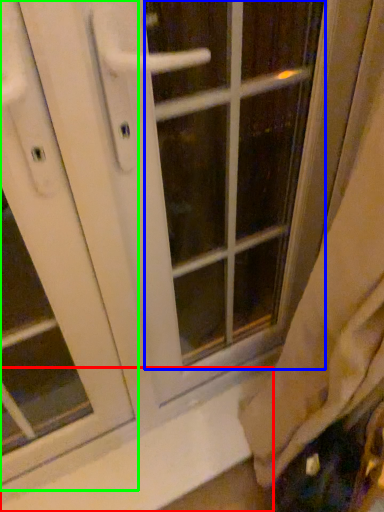
Question: Considering the real-world distances, which object is farthest from window sill (highlighted by a red box)? glass door (highlighted by a blue box) or screen door (highlighted by a green box)?

Choices:
 (A) glass door
 (B) screen door

Answer: (A)